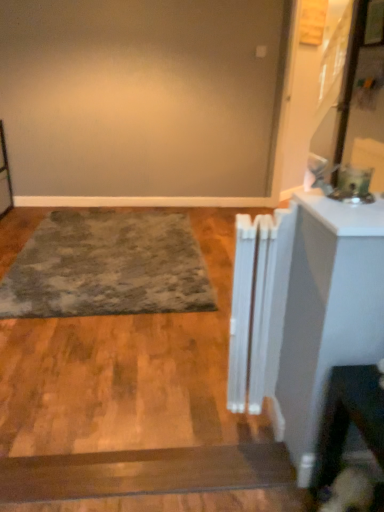
Question: Does fuzzy brown dog at lower right have a lesser width compared to textured gray rug at center?

Choices:
 (A) no
 (B) yes

Answer: (B)

Question: Is fuzzy brown dog at lower right smaller than textured gray rug at center?

Choices:
 (A) no
 (B) yes

Answer: (B)

Question: From the image's perspective, does fuzzy brown dog at lower right appear higher than textured gray rug at center?

Choices:
 (A) yes
 (B) no

Answer: (B)

Question: From a real-world perspective, is fuzzy brown dog at lower right physically below textured gray rug at center?

Choices:
 (A) yes
 (B) no

Answer: (B)

Question: Is fuzzy brown dog at lower right at the left side of textured gray rug at center?

Choices:
 (A) no
 (B) yes

Answer: (A)

Question: Can you confirm if fuzzy brown dog at lower right is taller than textured gray rug at center?

Choices:
 (A) yes
 (B) no

Answer: (A)

Question: Is textured gray rug at center directly adjacent to fuzzy brown dog at lower right?

Choices:
 (A) no
 (B) yes

Answer: (A)

Question: Does textured gray rug at center have a larger size compared to fuzzy brown dog at lower right?

Choices:
 (A) no
 (B) yes

Answer: (B)

Question: Is textured gray rug at center far away from fuzzy brown dog at lower right?

Choices:
 (A) no
 (B) yes

Answer: (B)

Question: Considering the relative sizes of textured gray rug at center and fuzzy brown dog at lower right in the image provided, is textured gray rug at center taller than fuzzy brown dog at lower right?

Choices:
 (A) no
 (B) yes

Answer: (A)

Question: From a real-world perspective, is textured gray rug at center physically above fuzzy brown dog at lower right?

Choices:
 (A) yes
 (B) no

Answer: (B)

Question: Is textured gray rug at center turned away from fuzzy brown dog at lower right?

Choices:
 (A) yes
 (B) no

Answer: (B)

Question: Does textured gray rug at center have a larger size compared to white glossy counter top at right?

Choices:
 (A) yes
 (B) no

Answer: (A)